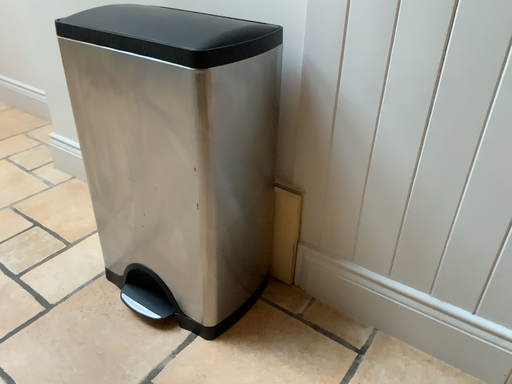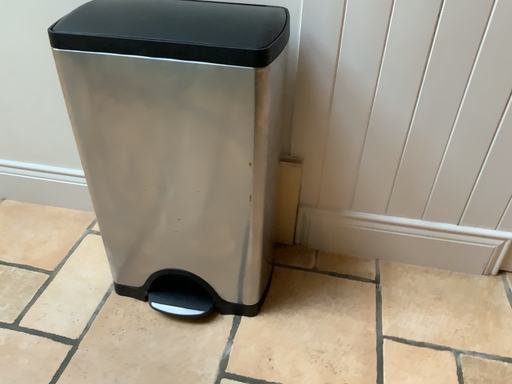
Question: How did the camera likely rotate when shooting the video?

Choices:
 (A) rotated right
 (B) rotated left

Answer: (A)